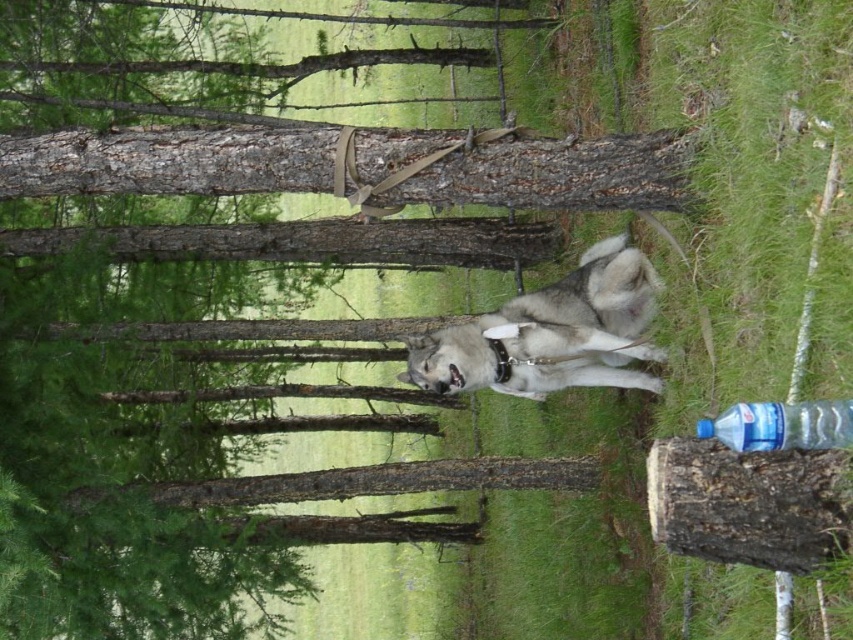
Question: In this image, where is smooth bark tree trunk at center located relative to white fur dog at center?

Choices:
 (A) left
 (B) right

Answer: (A)

Question: Based on their relative distances, which object is nearer to the smooth bark tree trunk at center?

Choices:
 (A) white fur dog at center
 (B) rough bark log at lower right

Answer: (A)

Question: Which object is closer to the camera taking this photo?

Choices:
 (A) rough bark log at lower right
 (B) smooth bark tree trunk at center
 (C) white fur dog at center
 (D) sleek gray fur at center

Answer: (A)

Question: Which point is closer to the camera?

Choices:
 (A) (554, 328)
 (B) (503, 360)
 (C) (790, 422)
 (D) (662, 531)

Answer: (D)

Question: Can you confirm if rough bark log at lower right is positioned to the left of white fur dog at center?

Choices:
 (A) yes
 (B) no

Answer: (A)

Question: Does smooth bark tree trunk at center come in front of rough bark log at lower right?

Choices:
 (A) yes
 (B) no

Answer: (B)